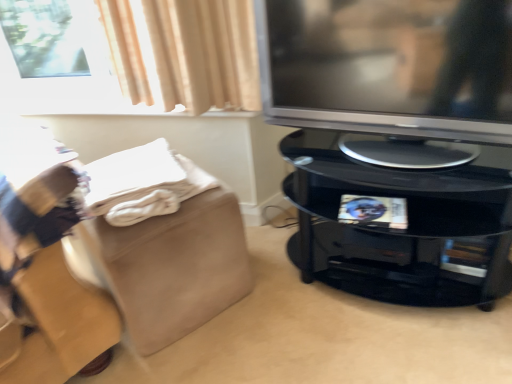
The width and height of the screenshot is (512, 384). Find the location of `blank area beneath satin silver television at right (from a real-world perspective)`. blank area beneath satin silver television at right (from a real-world perspective) is located at coordinates (364, 140).